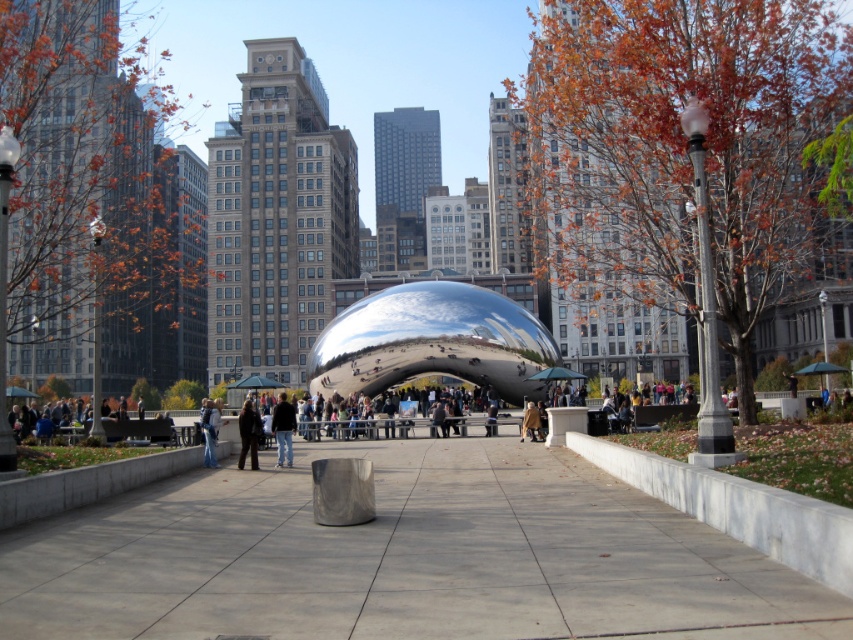
Can you confirm if dark brown leather jacket at center is positioned to the right of denim jacket at center?

Indeed, dark brown leather jacket at center is positioned on the right side of denim jacket at center.

Can you confirm if dark brown leather jacket at center is wider than denim jacket at center?

In fact, dark brown leather jacket at center might be narrower than denim jacket at center.

Who is more distant from viewer, (253, 452) or (212, 429)?

The point (212, 429) is behind.

You are a GUI agent. You are given a task and a screenshot of the screen. Output one action in this format:
    pyautogui.click(x=<x>, y=<y>)
    Task: Click on the dark brown leather jacket at center
    The height and width of the screenshot is (640, 853).
    Given the screenshot: What is the action you would take?
    pyautogui.click(x=248, y=435)

Does gray concrete pavement at center have a lesser width compared to black leather jacket at center?

No, gray concrete pavement at center is not thinner than black leather jacket at center.

The height and width of the screenshot is (640, 853). Find the location of `gray concrete pavement at center`. gray concrete pavement at center is located at coordinates (401, 557).

Who is positioned more to the left, black leather jacket at center or denim jacket at center?

black leather jacket at center is more to the left.

Is black leather jacket at center bigger than denim jacket at center?

Yes, black leather jacket at center is bigger than denim jacket at center.

What do you see at coordinates (283, 428) in the screenshot? The image size is (853, 640). I see `black leather jacket at center` at bounding box center [283, 428].

This screenshot has height=640, width=853. I want to click on black leather jacket at center, so click(x=283, y=428).